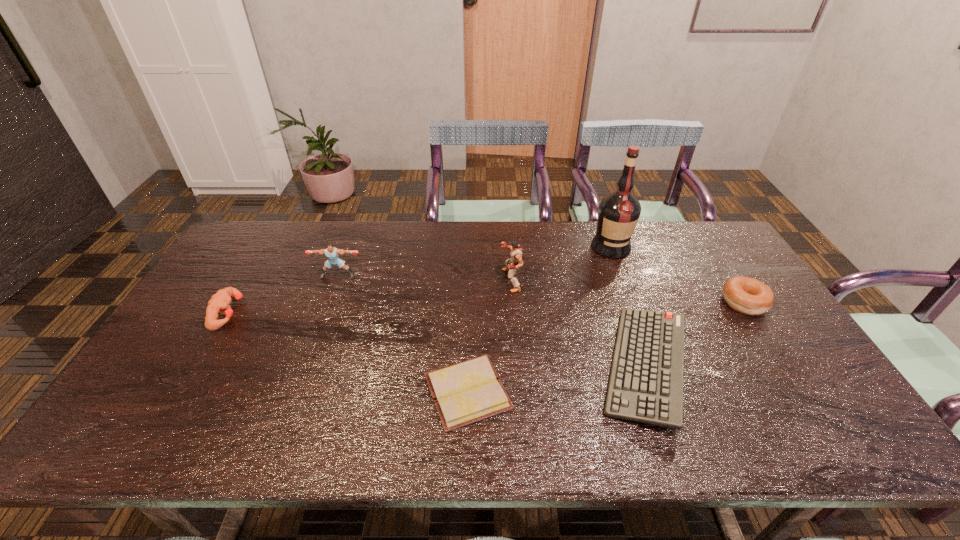
I want to click on free space between the second tallest puncher and the computer keyboard, so click(492, 322).

Where is `vacant point located between the diary and the bagel`? Image resolution: width=960 pixels, height=540 pixels. vacant point located between the diary and the bagel is located at coordinates (606, 347).

Identify which object is located as the sixth nearest to the second puncher from left to right. Please provide its 2D coordinates. Your answer should be formatted as a tuple, i.e. [(x, y)], where the tuple contains the x and y coordinates of a point satisfying the conditions above.

[(749, 296)]

Identify which object is the fifth closest to the shortest object. Please provide its 2D coordinates. Your answer should be formatted as a tuple, i.e. [(x, y)], where the tuple contains the x and y coordinates of a point satisfying the conditions above.

[(219, 303)]

This screenshot has height=540, width=960. In order to click on puncher that is the second closest one to the leftmost puncher in this screenshot , I will do `click(515, 262)`.

Locate which puncher ranks second in proximity to the tallest object. Please provide its 2D coordinates. Your answer should be formatted as a tuple, i.e. [(x, y)], where the tuple contains the x and y coordinates of a point satisfying the conditions above.

[(332, 253)]

The image size is (960, 540). I want to click on free space that satisfies the following two spatial constraints: 1. on the back side of the computer keyboard; 2. on the left side of the rightmost object, so click(623, 302).

Where is `vacant area that satisfies the following two spatial constraints: 1. on the front-facing side of the rightmost puncher; 2. on the back side of the bagel`? Image resolution: width=960 pixels, height=540 pixels. vacant area that satisfies the following two spatial constraints: 1. on the front-facing side of the rightmost puncher; 2. on the back side of the bagel is located at coordinates (513, 302).

I want to click on vacant space that satisfies the following two spatial constraints: 1. on the front-facing side of the second shortest puncher; 2. on the right side of the computer keyboard, so click(x=304, y=367).

Identify the location of free space that satisfies the following two spatial constraints: 1. with the gloves of the diary facing forward; 2. on the left side of the leftmost puncher. This screenshot has width=960, height=540. click(182, 392).